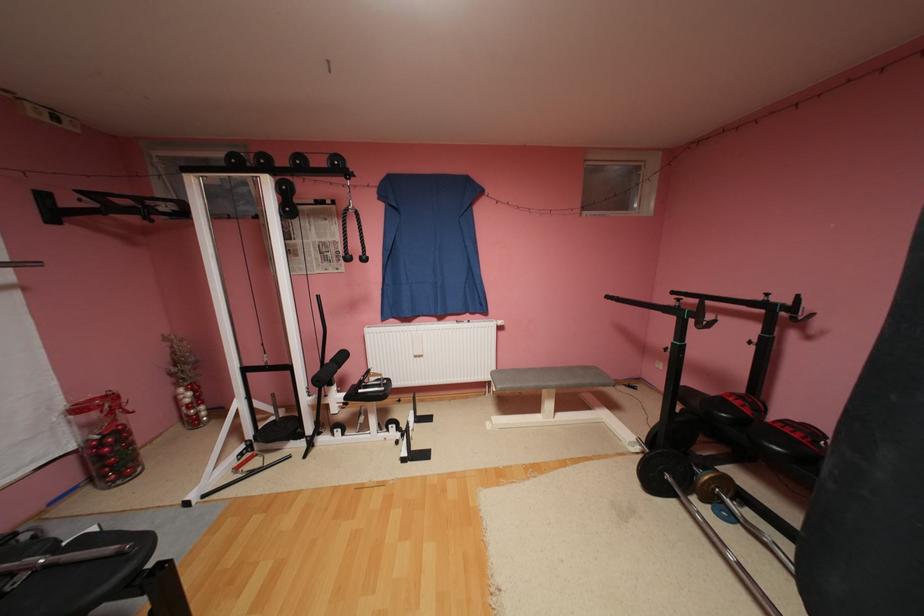
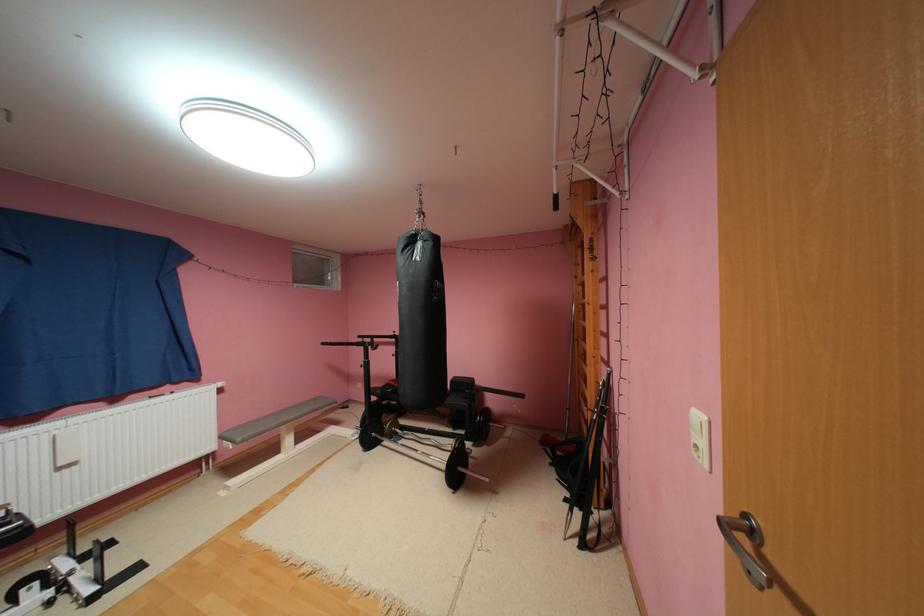
Find the pixel in the second image that matches (647,448) in the first image.

(366, 436)